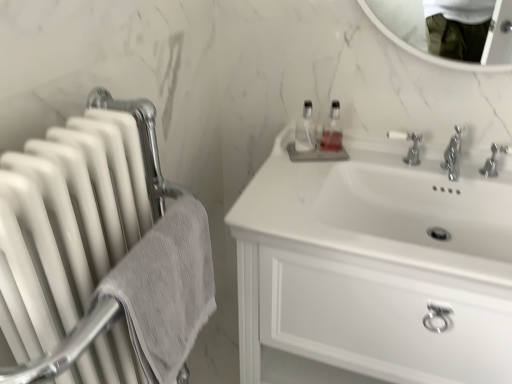
Locate an element on the screen. free space to the left of polished chrome faucet at center right, which ranks as the second tap in left-to-right order is located at coordinates (436, 170).